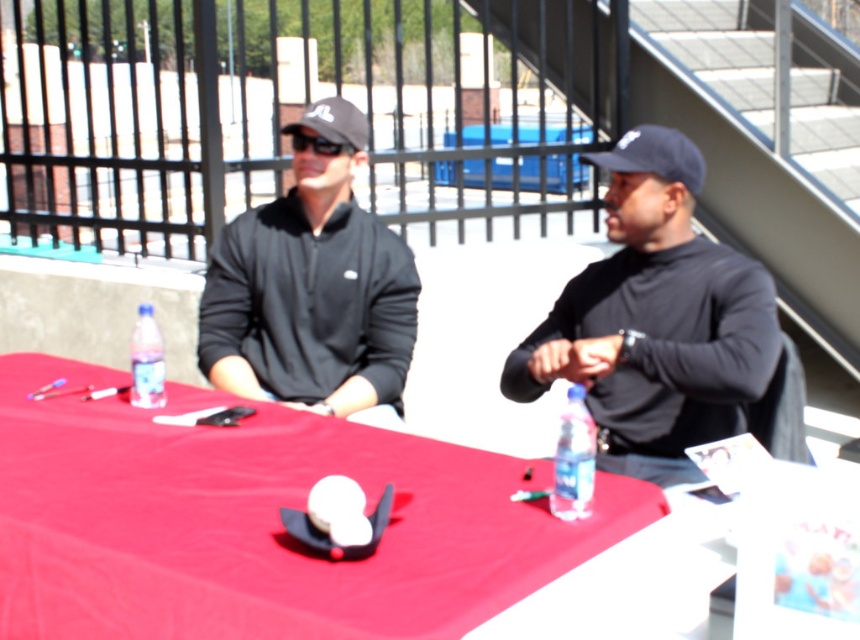
Is point (665, 168) farther from viewer compared to point (298, 136)?

No, it is not.

The width and height of the screenshot is (860, 640). What do you see at coordinates (654, 156) in the screenshot?
I see `black fabric baseball cap at center` at bounding box center [654, 156].

Who is more distant from viewer, (x=650, y=160) or (x=309, y=145)?

The point (x=309, y=145) is behind.

Identify the location of black fabric baseball cap at center. (654, 156).

Which of these two, black fabric baseball cap at center or clear plastic bottle at table left, stands taller?

clear plastic bottle at table left is taller.

Is point (636, 141) behind point (134, 333)?

No, (636, 141) is closer to viewer.

Measure the distance between point (693, 168) and camera.

Point (693, 168) and camera are 8.32 feet apart from each other.

The width and height of the screenshot is (860, 640). Find the location of `black fabric baseball cap at center`. black fabric baseball cap at center is located at coordinates (654, 156).

Looking at this image, does translucent plastic bottle at table right have a smaller size compared to black plastic sunglasses at upper center?

Actually, translucent plastic bottle at table right might be larger than black plastic sunglasses at upper center.

Is translucent plastic bottle at table right above black plastic sunglasses at upper center?

Incorrect, translucent plastic bottle at table right is not positioned above black plastic sunglasses at upper center.

Where is `translucent plastic bottle at table right`? The height and width of the screenshot is (640, 860). translucent plastic bottle at table right is located at coordinates (573, 460).